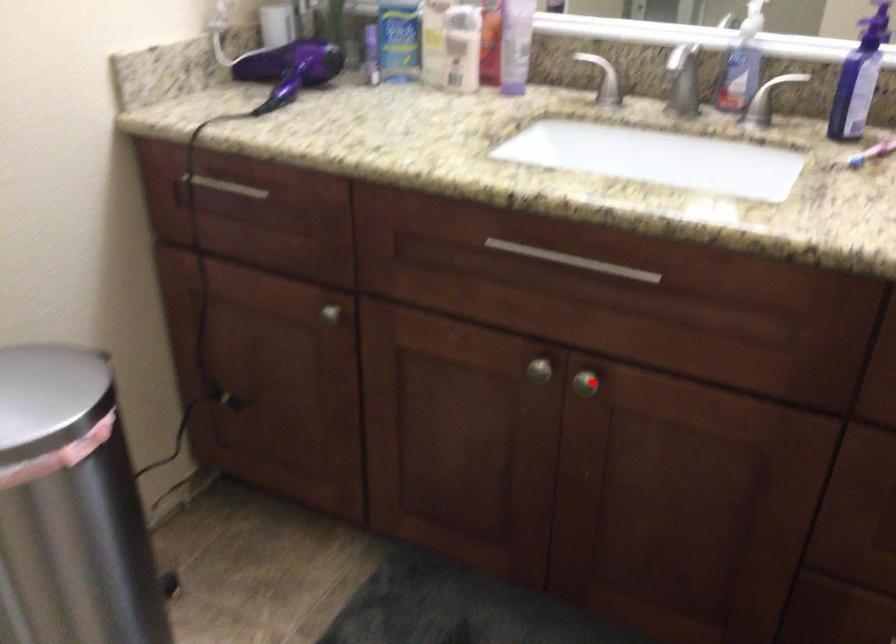
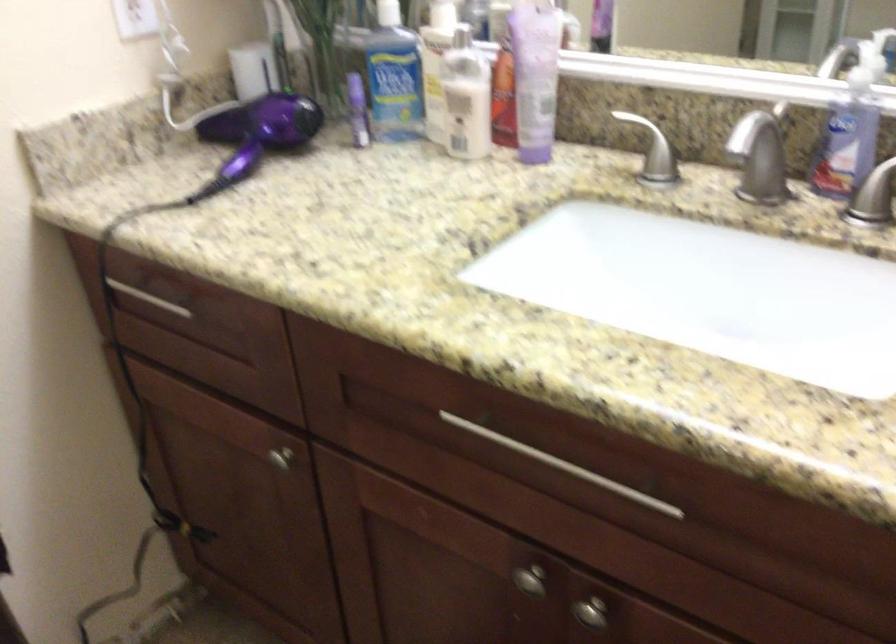
Question: A red point is marked in image1. In image2, is the corresponding 3D point closer to the camera or farther? Reply with the corresponding letter.

Choices:
 (A) The corresponding 3D point is closer.
 (B) The corresponding 3D point is farther.

Answer: (A)